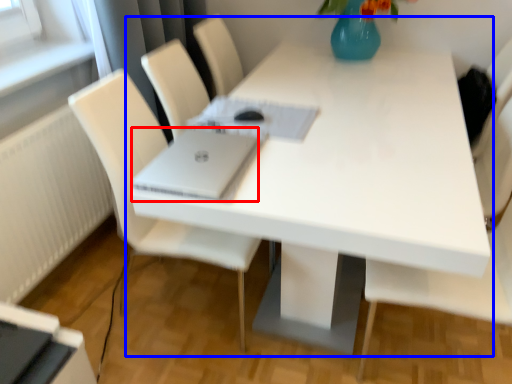
Question: Which object appears closest to the camera in this image, laptop (highlighted by a red box) or table (highlighted by a blue box)?

Choices:
 (A) laptop
 (B) table

Answer: (B)